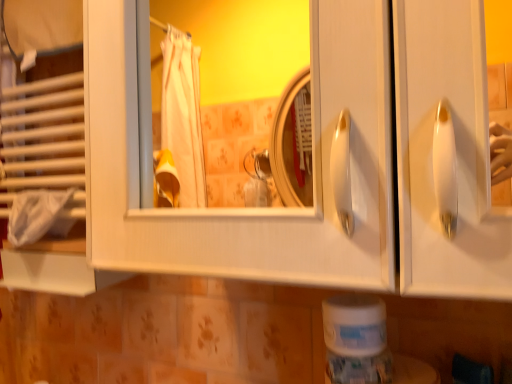
Question: Considering the relative sizes of white fabric bath towel at left and white matte toilet paper at lower center in the image provided, is white fabric bath towel at left smaller than white matte toilet paper at lower center?

Choices:
 (A) no
 (B) yes

Answer: (A)

Question: Is the depth of white fabric bath towel at left greater than that of white matte toilet paper at lower center?

Choices:
 (A) no
 (B) yes

Answer: (B)

Question: Is white matte toilet paper at lower center surrounded by white fabric bath towel at left?

Choices:
 (A) yes
 (B) no

Answer: (B)

Question: Is white fabric bath towel at left positioned before white matte toilet paper at lower center?

Choices:
 (A) yes
 (B) no

Answer: (B)

Question: Is white fabric bath towel at left outside white matte toilet paper at lower center?

Choices:
 (A) yes
 (B) no

Answer: (A)

Question: Is white fabric bath towel at left facing towards white matte toilet paper at lower center?

Choices:
 (A) no
 (B) yes

Answer: (A)

Question: Considering the relative positions of white matte toilet paper at lower center and white fabric bath towel at left in the image provided, is white matte toilet paper at lower center to the right of white fabric bath towel at left from the viewer's perspective?

Choices:
 (A) yes
 (B) no

Answer: (A)

Question: From a real-world perspective, does white matte toilet paper at lower center stand above white fabric bath towel at left?

Choices:
 (A) yes
 (B) no

Answer: (B)

Question: From the image's perspective, is white matte toilet paper at lower center located above white fabric bath towel at left?

Choices:
 (A) yes
 (B) no

Answer: (B)

Question: From the image's perspective, is white matte toilet paper at lower center under white fabric bath towel at left?

Choices:
 (A) no
 (B) yes

Answer: (B)

Question: Is white matte toilet paper at lower center with white fabric bath towel at left?

Choices:
 (A) no
 (B) yes

Answer: (A)

Question: From a real-world perspective, is white matte toilet paper at lower center physically below white fabric bath towel at left?

Choices:
 (A) no
 (B) yes

Answer: (B)

Question: Considering the positions of white fabric bath towel at left and white matte toilet paper at lower center in the image, is white fabric bath towel at left wider or thinner than white matte toilet paper at lower center?

Choices:
 (A) thin
 (B) wide

Answer: (A)